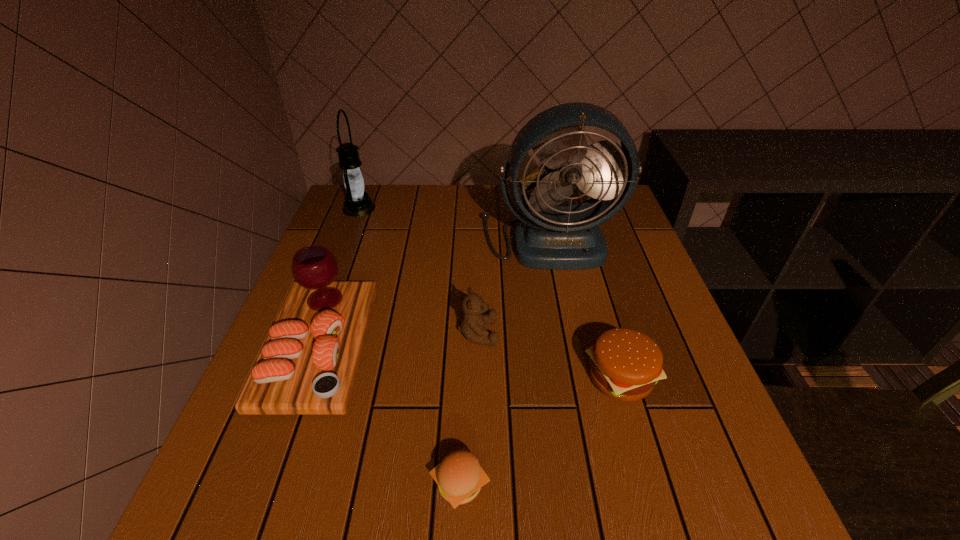
Find the location of a particular element. This screenshot has width=960, height=540. the tallest object is located at coordinates (554, 237).

In order to click on the fifth shortest object in this screenshot , I will do `click(358, 203)`.

Where is `platter`? The width and height of the screenshot is (960, 540). platter is located at coordinates (308, 364).

Identify the location of the third shortest object. (473, 323).

The height and width of the screenshot is (540, 960). What are the coordinates of `the fifth tallest object` in the screenshot? It's located at (625, 364).

The width and height of the screenshot is (960, 540). I want to click on the farther hamburger, so click(625, 364).

Image resolution: width=960 pixels, height=540 pixels. I want to click on the nearest object, so click(x=459, y=477).

Locate an element on the screen. the nearer hamburger is located at coordinates (459, 477).

In order to click on free space located in front of the tallest object to blow air in this screenshot , I will do `click(564, 319)`.

Locate an element on the screen. The height and width of the screenshot is (540, 960). blank area located 0.400m on the side where the lantern emits light is located at coordinates (508, 208).